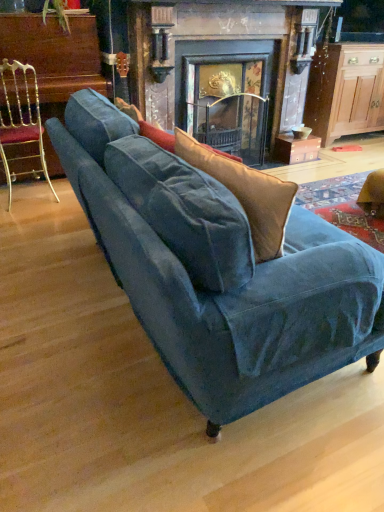
Question: Is wooden cabinet at right wider than gold metallic chair at left?

Choices:
 (A) no
 (B) yes

Answer: (B)

Question: Considering the relative positions of wooden cabinet at right and gold metallic chair at left in the image provided, is wooden cabinet at right to the right of gold metallic chair at left from the viewer's perspective?

Choices:
 (A) yes
 (B) no

Answer: (A)

Question: Does wooden cabinet at right contain gold metallic chair at left?

Choices:
 (A) no
 (B) yes

Answer: (A)

Question: Is wooden cabinet at right not inside gold metallic chair at left?

Choices:
 (A) yes
 (B) no

Answer: (A)

Question: From a real-world perspective, is wooden cabinet at right physically below gold metallic chair at left?

Choices:
 (A) no
 (B) yes

Answer: (A)

Question: Choose the correct answer: Is velvet blue couch at center inside gold metallic chair at left or outside it?

Choices:
 (A) inside
 (B) outside

Answer: (B)

Question: Considering the positions of velvet blue couch at center and gold metallic chair at left in the image, is velvet blue couch at center bigger or smaller than gold metallic chair at left?

Choices:
 (A) small
 (B) big

Answer: (B)

Question: From the image's perspective, relative to gold metallic chair at left, is velvet blue couch at center above or below?

Choices:
 (A) above
 (B) below

Answer: (B)

Question: Considering their positions, is velvet blue couch at center located in front of or behind gold metallic chair at left?

Choices:
 (A) front
 (B) behind

Answer: (A)

Question: Is point (211, 434) positioned closer to the camera than point (226, 105)?

Choices:
 (A) closer
 (B) farther

Answer: (A)

Question: Is velvet blue couch at center inside or outside of dark gray stone fireplace at center?

Choices:
 (A) inside
 (B) outside

Answer: (B)

Question: Looking at their shapes, would you say velvet blue couch at center is wider or thinner than dark gray stone fireplace at center?

Choices:
 (A) thin
 (B) wide

Answer: (B)

Question: From their relative heights in the image, would you say velvet blue couch at center is taller or shorter than dark gray stone fireplace at center?

Choices:
 (A) tall
 (B) short

Answer: (B)

Question: Considering the positions of wooden cabinet at right and dark gray stone fireplace at center in the image, is wooden cabinet at right taller or shorter than dark gray stone fireplace at center?

Choices:
 (A) tall
 (B) short

Answer: (B)

Question: Which is correct: wooden cabinet at right is inside dark gray stone fireplace at center, or outside of it?

Choices:
 (A) outside
 (B) inside

Answer: (A)